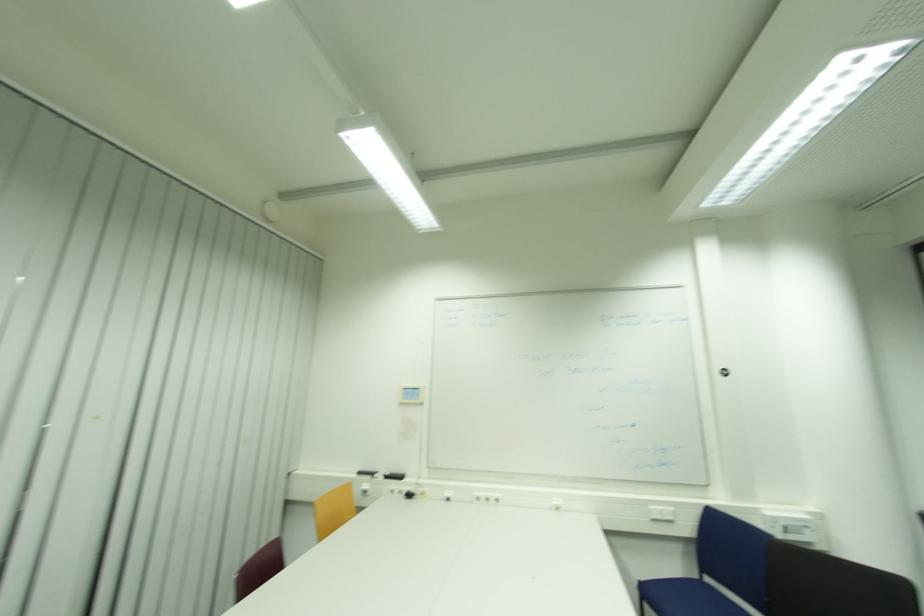
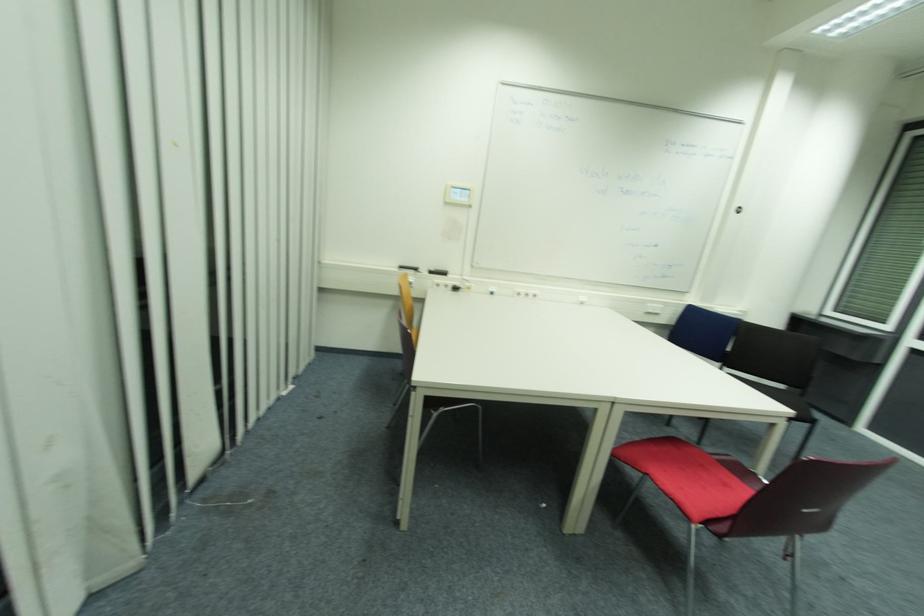
Find the pixel in the second image that matches [375,475] in the first image.

(419, 270)